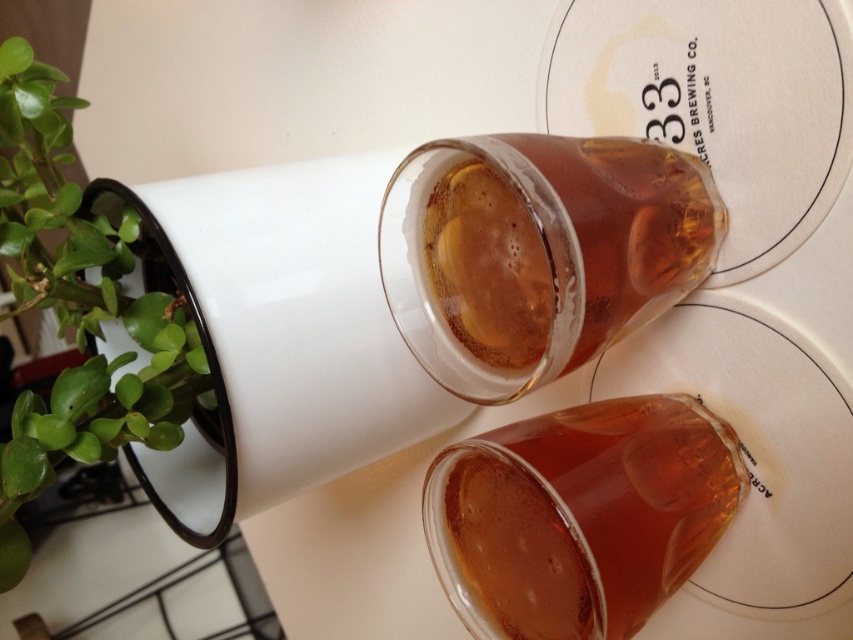
Question: Which is farther from the translucent amber glass at center?

Choices:
 (A) green leafy plant at left
 (B) translucent amber liquid at center

Answer: (A)

Question: Which point is closer to the camera taking this photo?

Choices:
 (A) (120, 413)
 (B) (486, 438)

Answer: (B)

Question: From the image, what is the correct spatial relationship of translucent amber liquid at center in relation to green leafy plant at left?

Choices:
 (A) left
 (B) right

Answer: (B)

Question: In this image, where is translucent amber glass at center located relative to translucent amber liquid at center?

Choices:
 (A) right
 (B) left

Answer: (B)

Question: Is translucent amber glass at center thinner than translucent amber liquid at center?

Choices:
 (A) no
 (B) yes

Answer: (A)

Question: Estimate the real-world distances between objects in this image. Which object is farther from the translucent amber liquid at center?

Choices:
 (A) green leafy plant at left
 (B) translucent amber glass at center

Answer: (A)